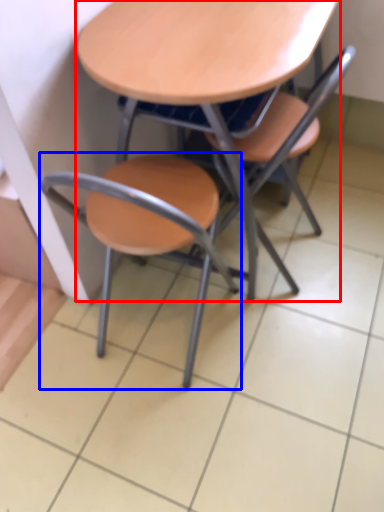
Question: Which object is further to the camera taking this photo, table (highlighted by a red box) or chair (highlighted by a blue box)?

Choices:
 (A) table
 (B) chair

Answer: (A)